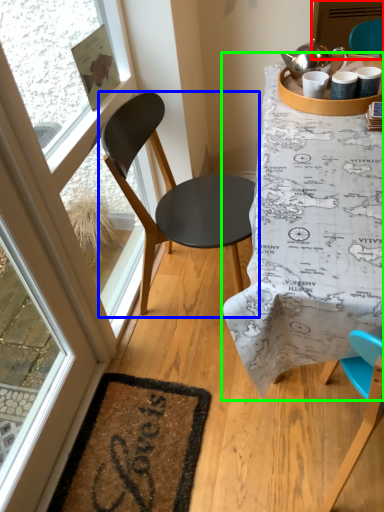
Question: Estimate the real-world distances between objects in this image. Which object is farther from screen door (highlighted by a red box), chair (highlighted by a blue box) or table (highlighted by a green box)?

Choices:
 (A) chair
 (B) table

Answer: (B)